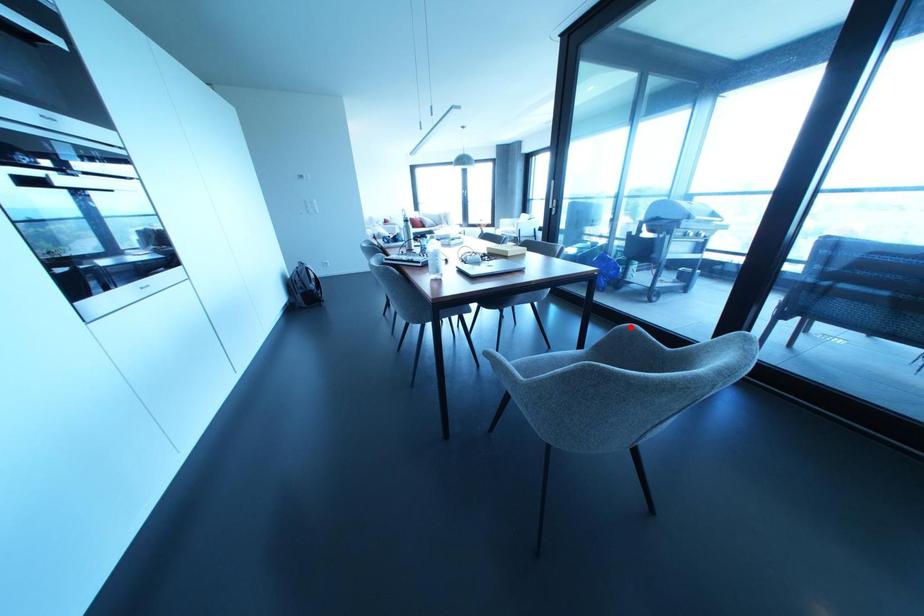
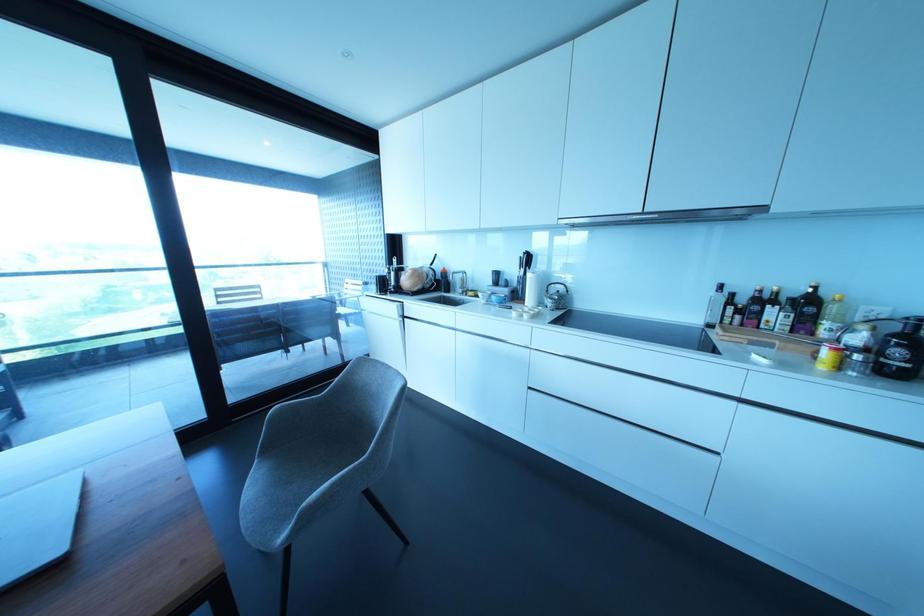
The point at the highlighted location is marked in the first image. Where is the corresponding point in the second image?

(282, 407)